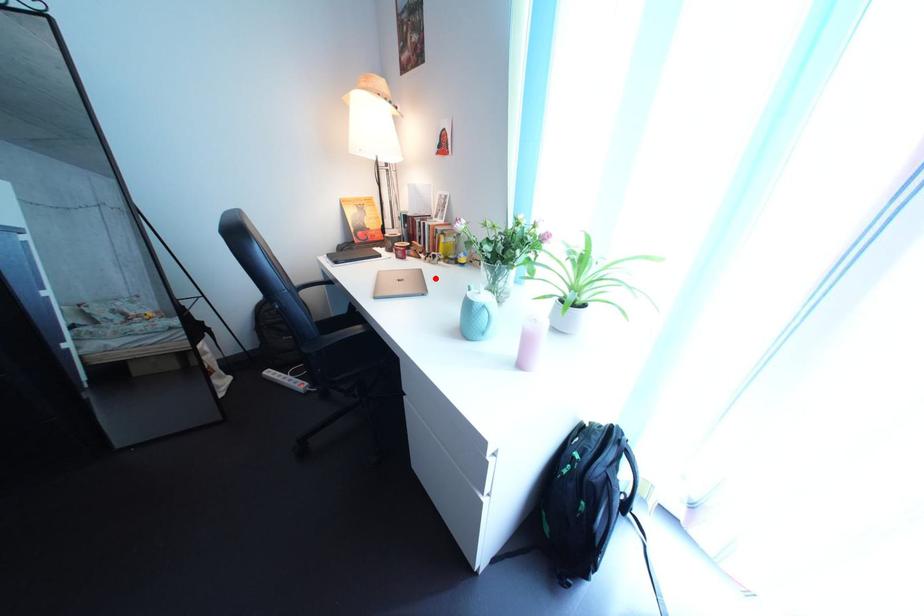
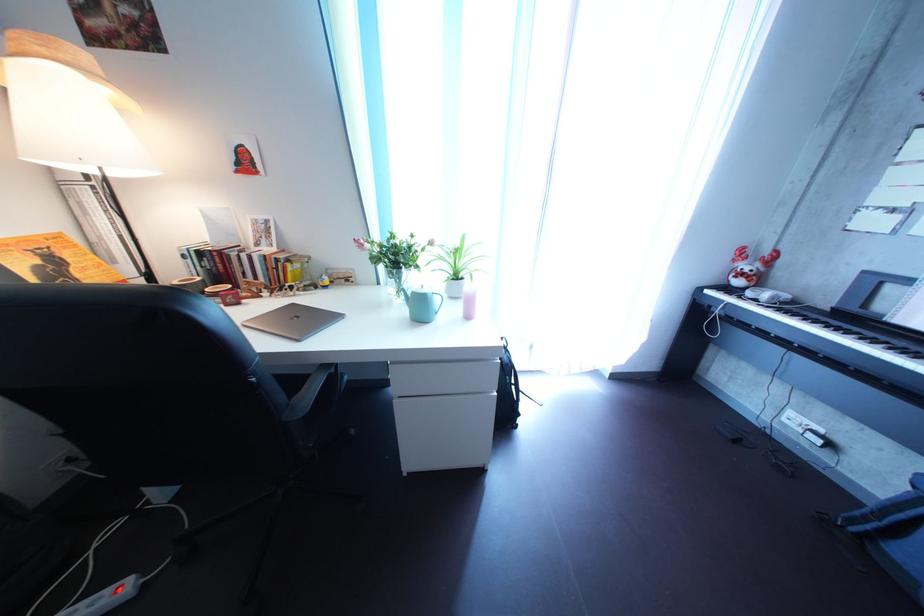
Locate, in the second image, the point that corresponds to the highlighted location in the first image.

(308, 313)